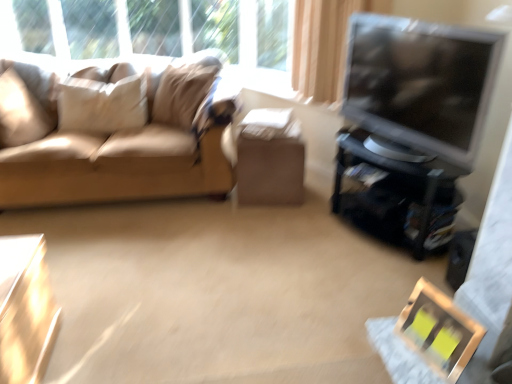
This screenshot has width=512, height=384. Find the location of `vacant space in front of matte cardboard box at center, the second table in the front-to-back sequence`. vacant space in front of matte cardboard box at center, the second table in the front-to-back sequence is located at coordinates (271, 218).